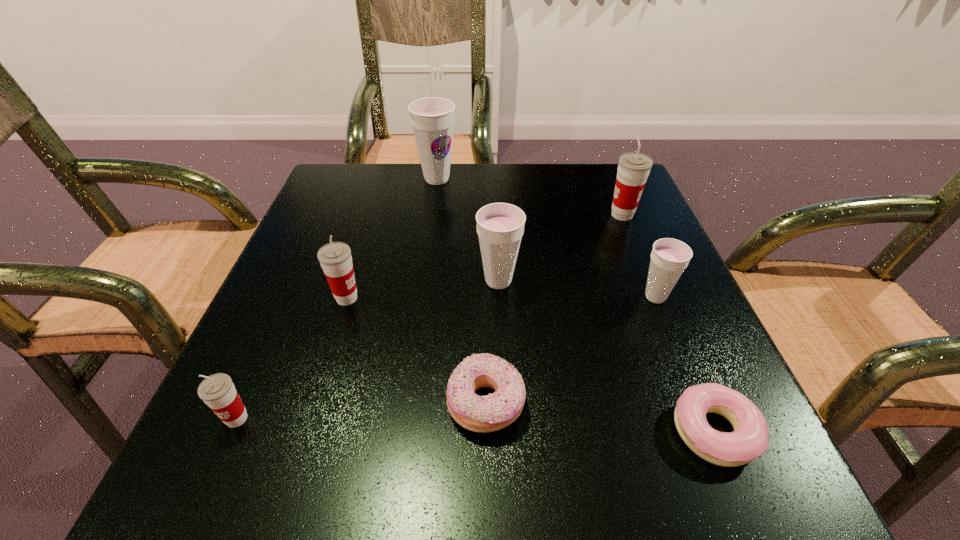
Find the location of a particular element. The width and height of the screenshot is (960, 540). cup that is the second closest to the second purple cup from right to left is located at coordinates (669, 257).

What are the coordinates of `red cup that is the closest one to the fifth nearest cup` in the screenshot? It's located at (335, 258).

Select which red cup appears as the closest to the second farthest red cup. Please provide its 2D coordinates. Your answer should be formatted as a tuple, i.e. [(x, y)], where the tuple contains the x and y coordinates of a point satisfying the conditions above.

[(217, 391)]

Choose which purple cup is the third nearest neighbor to the left doughnut. Please provide its 2D coordinates. Your answer should be formatted as a tuple, i.e. [(x, y)], where the tuple contains the x and y coordinates of a point satisfying the conditions above.

[(432, 118)]

At what (x,y) coordinates should I click in order to perform the action: click on the closest purple cup to the third cup from right to left. Please return your answer as a coordinate pair (x, y). The height and width of the screenshot is (540, 960). Looking at the image, I should click on [x=669, y=257].

Identify the location of vacant region that satisfies the following two spatial constraints: 1. on the front side of the farthest purple cup; 2. on the left side of the purple doughnut. (406, 403).

This screenshot has width=960, height=540. What are the coordinates of `free space that satisfies the following two spatial constraints: 1. on the side of the biggest red cup with the logo; 2. on the side of the smallest red cup with the logo` in the screenshot? It's located at (705, 418).

Identify the location of vacant region that satisfies the following two spatial constraints: 1. on the side of the rightmost red cup with the logo; 2. on the right side of the shortest object. The height and width of the screenshot is (540, 960). (710, 431).

The image size is (960, 540). In order to click on vacant area in the image that satisfies the following two spatial constraints: 1. on the back side of the pink doughnut; 2. on the side of the second farthest object with the logo in this screenshot , I will do `click(624, 215)`.

Find the location of a particular element. vacant region that satisfies the following two spatial constraints: 1. on the back side of the right doughnut; 2. on the side of the second smallest red cup with the logo is located at coordinates (659, 298).